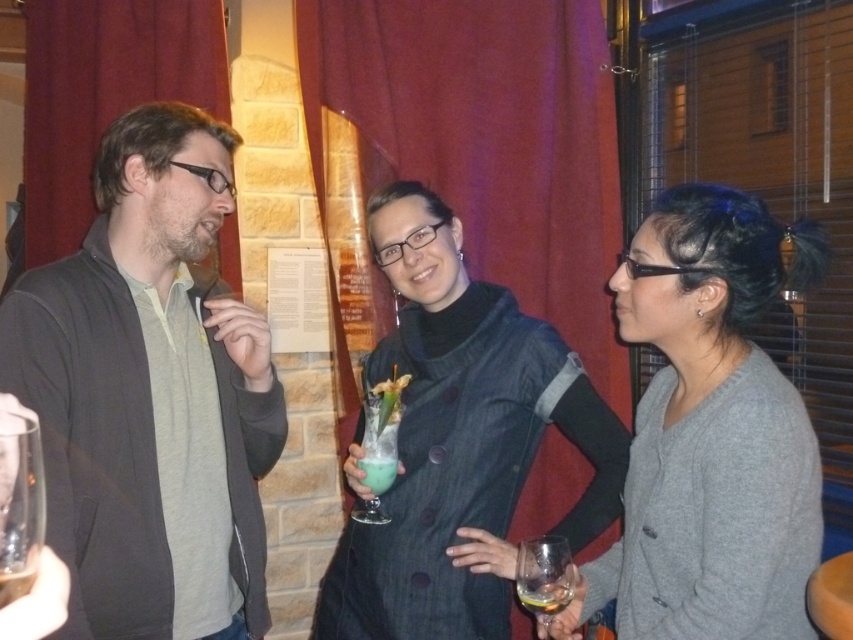
You are a bartender who needs to serve a customer. You have two glasses available in the scene. Which glass, the translucent glass at lower right or the clear glass at lower left, should you choose if you need to serve a larger drink?

The translucent glass at lower right is bigger than the clear glass at lower left, so you should choose the translucent glass at lower right to serve a larger drink.

You are at a social event and want to grab a drink. There are two glasses in view. The translucent glass at lower right and the green frosted glass at center. Which glass is closer to the floor?

The translucent glass at lower right is located below the green frosted glass at center, so it is closer to the floor.